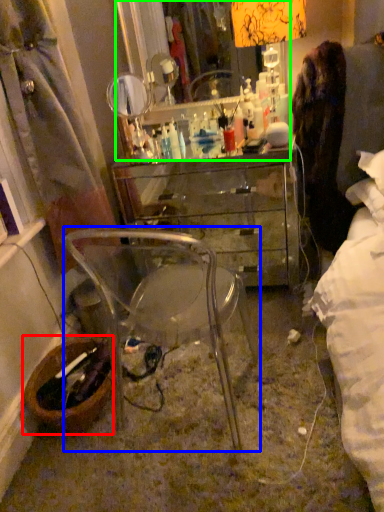
Question: Which is nearer to the picnic basket (highlighted by a red box)? chair (highlighted by a blue box) or mirror (highlighted by a green box).

Choices:
 (A) chair
 (B) mirror

Answer: (A)